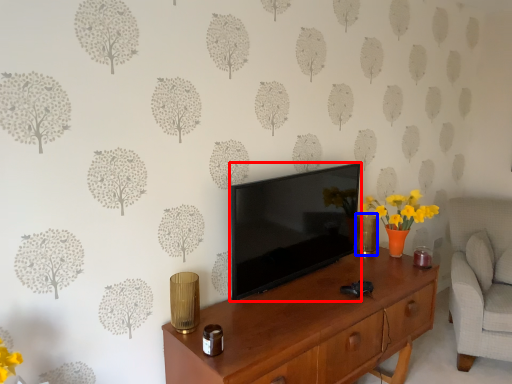
Question: Which point is closer to the camera, television (highlighted by a red box) or vase (highlighted by a blue box)?

Choices:
 (A) television
 (B) vase

Answer: (A)